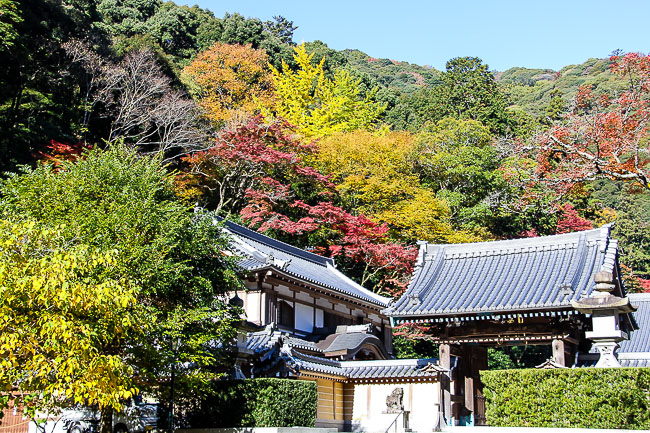
What are the coordinates of `white wall` in the screenshot? It's located at (378, 400), (359, 398), (428, 399), (251, 313), (302, 318), (322, 322).